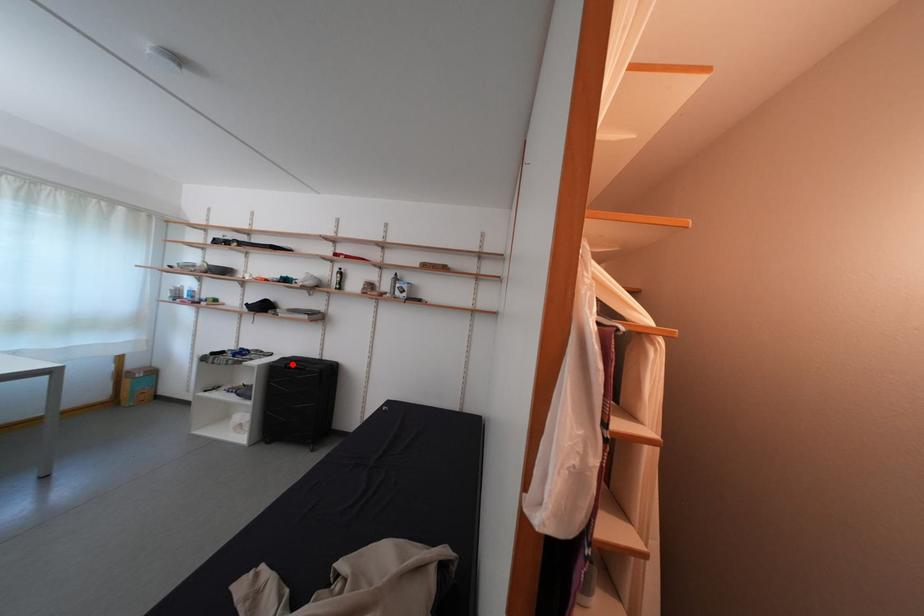
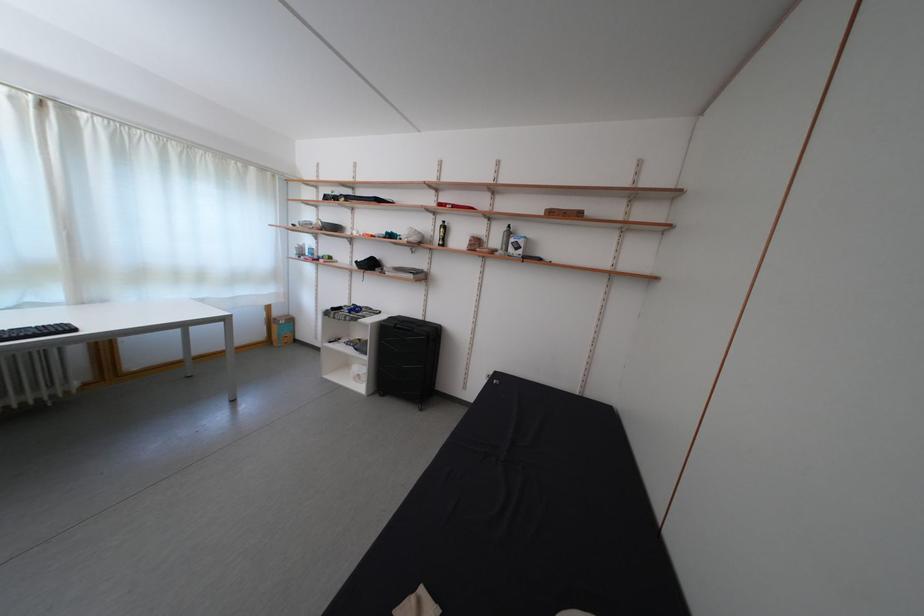
Find the pixel in the second image that matches the highlighted location in the first image.

(399, 323)